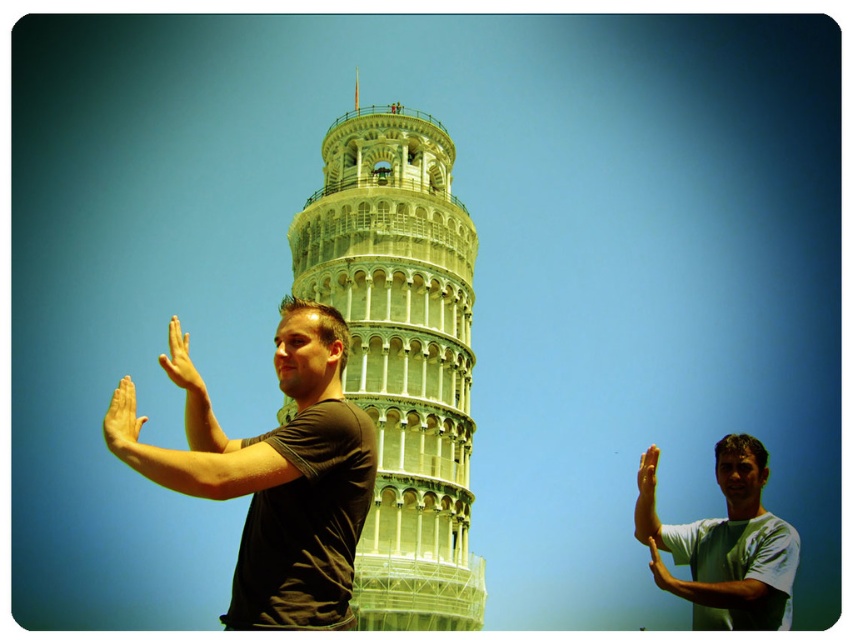
You are a photographer trying to capture a photo of the Leaning Tower of Pisa. You notice two hands in the frame, the green matte hand at right and the smooth skin hand at right. Which hand should you adjust to ensure both hands are the same size in the final image?

The green matte hand at right is larger in size than the smooth skin hand at right, so you should adjust the green matte hand at right to make it smaller to match the size of the smooth skin hand at right.

You are a photographer trying to capture a photo of the green stone tower at center and the smooth skin hand at right. Which object will appear larger in the photo?

The green stone tower at center will appear larger in the photo because it is much taller than the smooth skin hand at right.